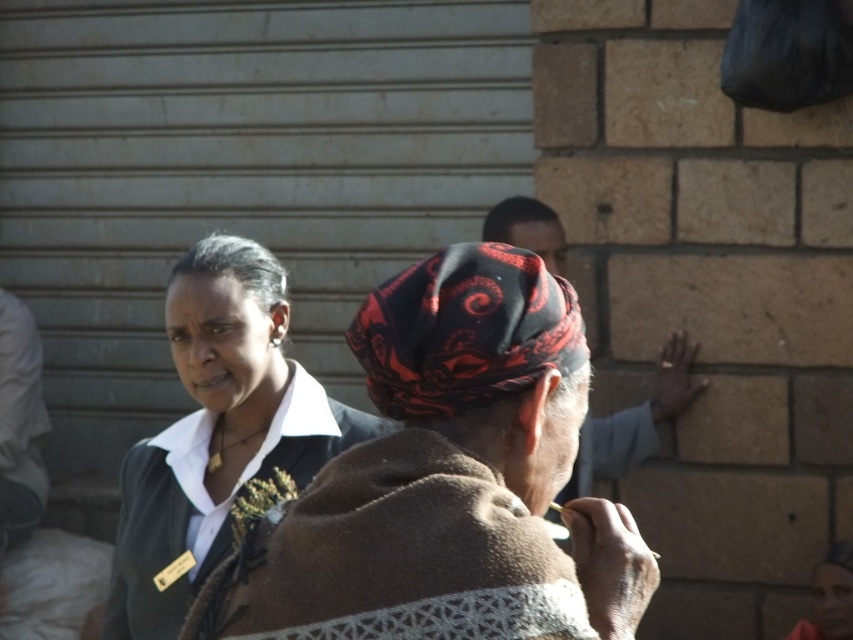
You are standing in an urban area and see two points marked in the scene. Which point is closer to you, point (x=277, y=378) or point (x=521, y=324)?

Point (x=277, y=378) is closer to you because it is further to the viewer than point (x=521, y=324).

You are standing in an urban area and see a person wearing a brown woolen shawl at center and a black matte jacket at center. Which item is positioned more to the right?

The brown woolen shawl at center is positioned more to the right than the black matte jacket at center.

You are a fashion designer observing the two items at the center of the image, the black matte jacket at center and the black woven headscarf at center. Which item has a greater width?

The black matte jacket at center has a greater width than the black woven headscarf at center.